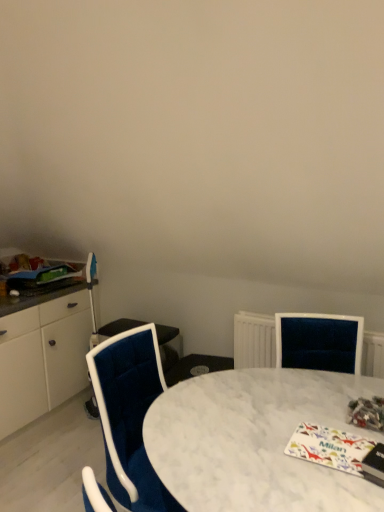
This screenshot has height=512, width=384. I want to click on vacant space underneath white glossy magazine at lower right, which is the third magazine from top to bottom (from a real-world perspective), so click(x=322, y=444).